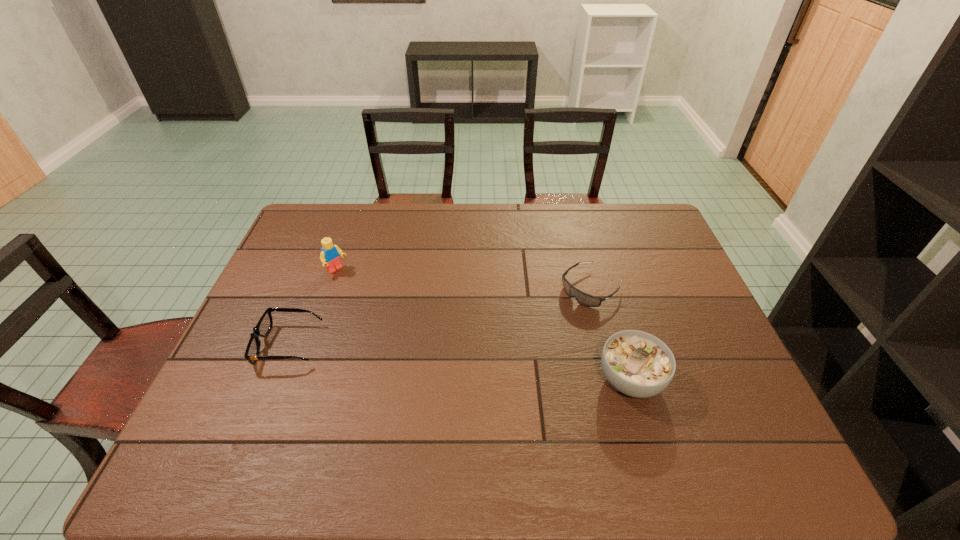
The height and width of the screenshot is (540, 960). I want to click on vacant space situated 0.090m on the front-facing side of the Lego, so click(359, 290).

Locate an element on the screen. This screenshot has width=960, height=540. object that is at the near edge is located at coordinates (638, 364).

The width and height of the screenshot is (960, 540). In order to click on sunglasses positioned at the left edge in this screenshot , I will do `click(264, 325)`.

Identify the location of Lego that is at the left edge. (330, 254).

In the image, there is a desktop. What are the coordinates of `vacant space at the far edge` in the screenshot? It's located at (501, 210).

Find the location of a particular element. Image resolution: width=960 pixels, height=540 pixels. vacant space at the near edge of the desktop is located at coordinates point(348,403).

Find the location of a particular element. free space at the left edge of the desktop is located at coordinates (261, 365).

Image resolution: width=960 pixels, height=540 pixels. Find the location of `free space at the right edge of the desktop`. free space at the right edge of the desktop is located at coordinates (688, 287).

Where is `vacant area at the far left corner`? This screenshot has height=540, width=960. vacant area at the far left corner is located at coordinates (318, 227).

Where is `free point at the far right corner`? This screenshot has width=960, height=540. free point at the far right corner is located at coordinates (621, 218).